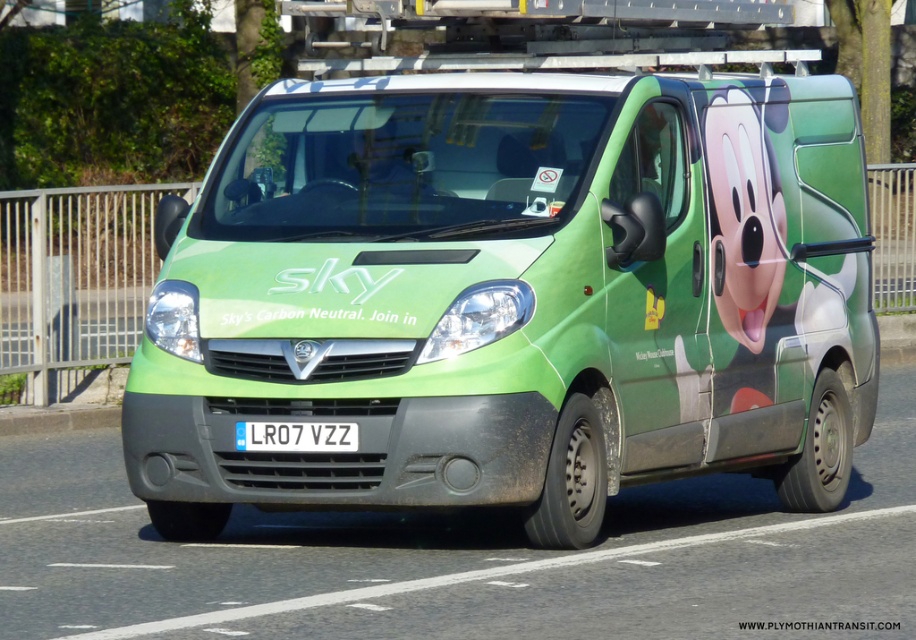
In the scene shown: Does green matte van at center come in front of white plastic license plate at center?

That is True.

Is point (849, 173) positioned in front of point (302, 445)?

No, it is not.

Which is behind, point (714, 353) or point (266, 451)?

The point (714, 353) is more distant.

The image size is (916, 640). In order to click on green matte van at center in this screenshot , I will do `click(511, 298)`.